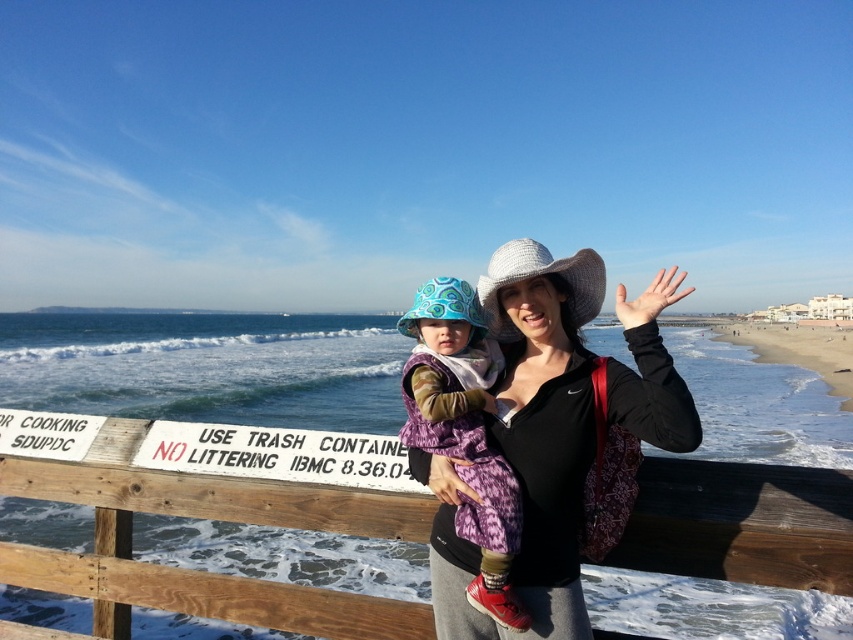
You are a visitor at the beach and see the wooden at center and the matte black jacket at center. Which object is positioned lower in the image?

The wooden at center is positioned lower than the matte black jacket at center in the image.